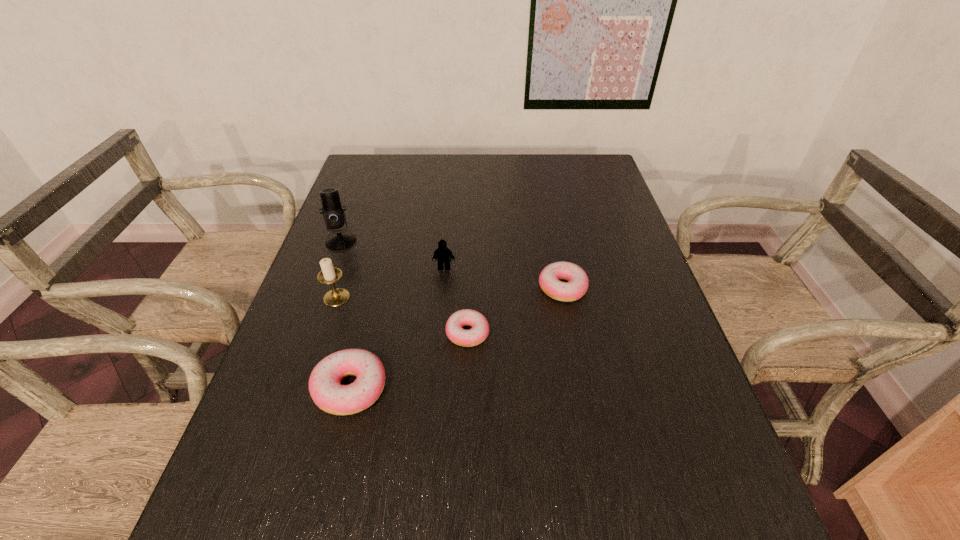
The width and height of the screenshot is (960, 540). Find the location of `vacant space that satisfies the following two spatial constraints: 1. on the stand of the microphone; 2. on the left side of the nearest doughnut`. vacant space that satisfies the following two spatial constraints: 1. on the stand of the microphone; 2. on the left side of the nearest doughnut is located at coordinates (286, 389).

Find the location of a particular element. The width and height of the screenshot is (960, 540). blank space that satisfies the following two spatial constraints: 1. on the stand of the farthest object; 2. on the right side of the second tallest object is located at coordinates (320, 298).

Locate an element on the screen. free space in the image that satisfies the following two spatial constraints: 1. on the face of the Lego; 2. on the right side of the second farthest doughnut is located at coordinates (438, 333).

In order to click on free location that satisfies the following two spatial constraints: 1. on the stand of the rightmost object; 2. on the left side of the farthest object in this screenshot , I will do `click(324, 288)`.

The width and height of the screenshot is (960, 540). Identify the location of free location that satisfies the following two spatial constraints: 1. on the stand of the farthest object; 2. on the left side of the second nearest object. (306, 333).

Where is `free space that satisfies the following two spatial constraints: 1. on the front side of the shortest object; 2. on the right side of the second tallest object`? free space that satisfies the following two spatial constraints: 1. on the front side of the shortest object; 2. on the right side of the second tallest object is located at coordinates [324, 333].

Where is `vacant space that satisfies the following two spatial constraints: 1. on the face of the second shortest object; 2. on the left side of the fourth shortest object`? The height and width of the screenshot is (540, 960). vacant space that satisfies the following two spatial constraints: 1. on the face of the second shortest object; 2. on the left side of the fourth shortest object is located at coordinates (443, 288).